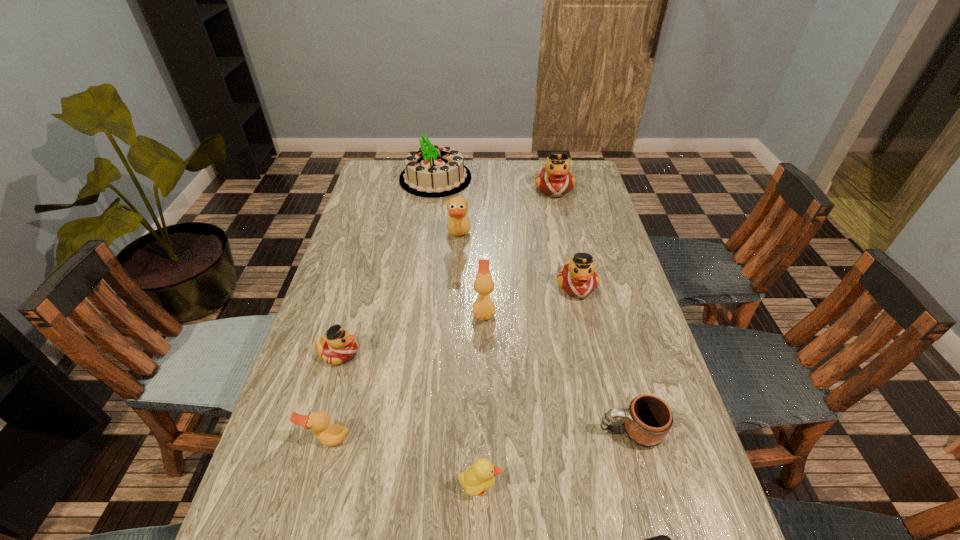
Image resolution: width=960 pixels, height=540 pixels. I want to click on vacant space located on the beak of the fourth duck from left to right, so click(x=346, y=310).

Find the location of a particular element. This screenshot has width=960, height=540. free space located 0.300m on the beak of the fourth duck from left to right is located at coordinates (367, 310).

The height and width of the screenshot is (540, 960). I want to click on vacant space located 0.350m on the face of the smallest red duck, so [x=495, y=354].

Locate an element on the screen. vacant space located on the beak of the nearest duck is located at coordinates (309, 509).

Where is `free region located on the front-facing side of the yellow duckling`? free region located on the front-facing side of the yellow duckling is located at coordinates click(663, 486).

Where is `blank space located on the side of the mug with the handle`? The width and height of the screenshot is (960, 540). blank space located on the side of the mug with the handle is located at coordinates (563, 431).

Locate an element on the screen. The height and width of the screenshot is (540, 960). blank area located 0.290m on the side of the mug with the handle is located at coordinates (468, 431).

What are the coordinates of `free space located 0.220m on the side of the mug with the handle` in the screenshot? It's located at (499, 431).

Identify the location of birthday cake present at the far edge. The width and height of the screenshot is (960, 540). (431, 171).

At what (x,y) coordinates should I click in order to perform the action: click on duck present at the far edge. Please return your answer as a coordinate pair (x, y). Image resolution: width=960 pixels, height=540 pixels. Looking at the image, I should click on (555, 180).